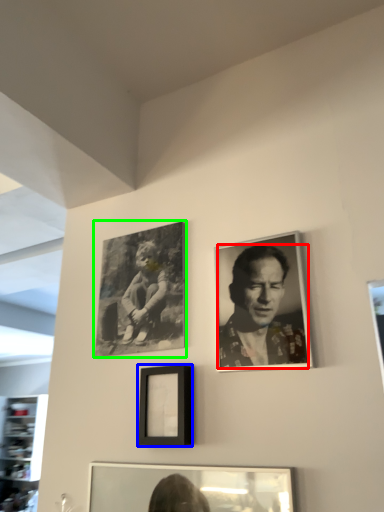
Question: Based on their relative distances, which object is farther from man (highlighted by a red box)? Choose from picture frame (highlighted by a blue box) and picture frame (highlighted by a green box).

Choices:
 (A) picture frame
 (B) picture frame

Answer: (B)